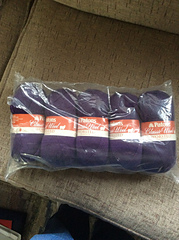
The image size is (179, 240). I want to click on rug, so click(46, 208).